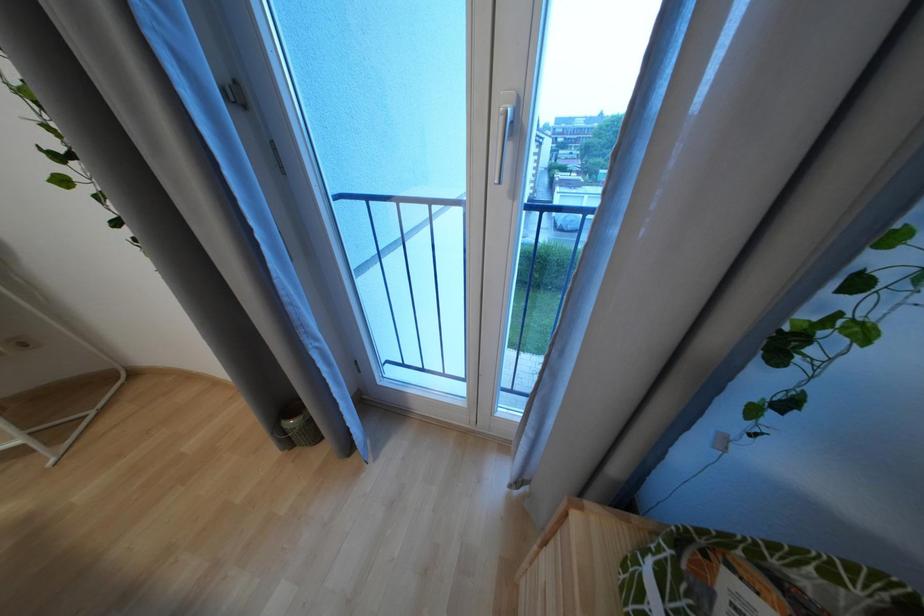
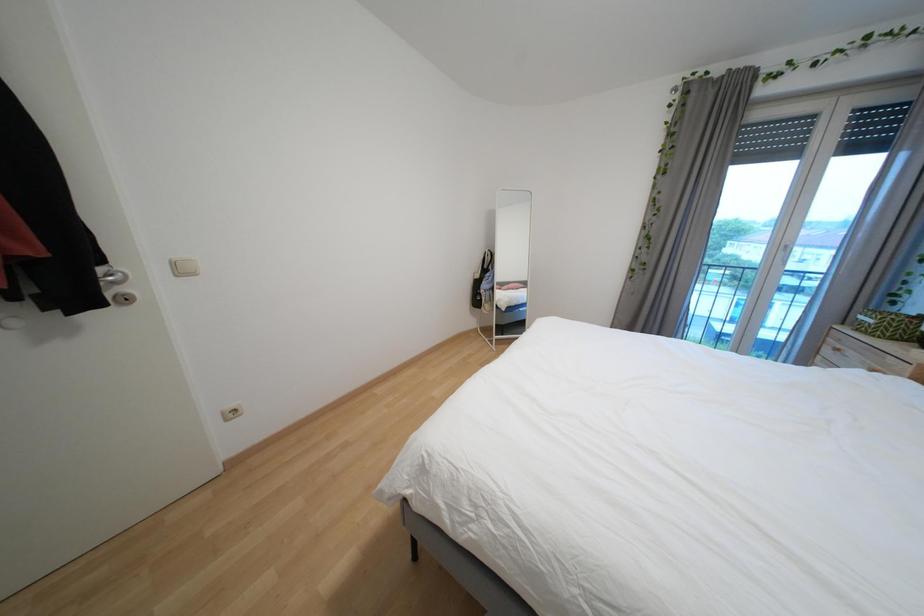
The images are taken continuously from a first-person perspective. In which direction are you moving?

The movement direction of the cameraman is left, backward.